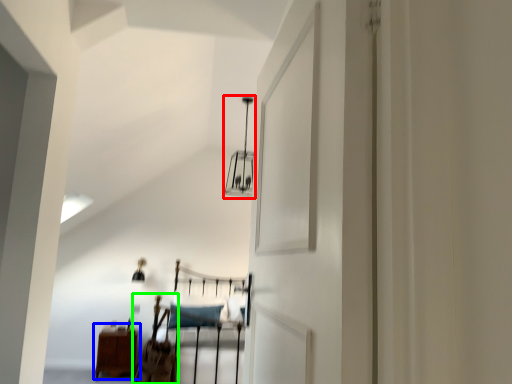
Question: Estimate the real-world distances between objects in this image. Which object is closer to light fixture (highlighted by a red box), furniture (highlighted by a blue box) or chair (highlighted by a green box)?

Choices:
 (A) furniture
 (B) chair

Answer: (B)